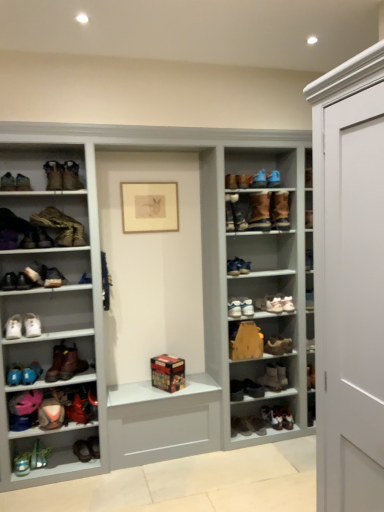
What is the approximate width of brown leather boot at lower left, acting as the ninth footwear starting from the bottom?

brown leather boot at lower left, acting as the ninth footwear starting from the bottom, is 25.95 centimeters in width.

What is the approximate width of shiny black sneakers at lower center, which ranks as the 4th footwear in bottom-to-top order?

shiny black sneakers at lower center, which ranks as the 4th footwear in bottom-to-top order, is 9.45 inches wide.

The image size is (384, 512). I want to click on leather boot at lower center, the ninth shoe viewed from the top, so click(239, 426).

Find the location of a particular element. This screenshot has height=512, width=384. wooden box at center is located at coordinates tap(168, 373).

Identify the location of matte brown boot at upper left, positioned as the 3th shoe in top-to-bottom order. Image resolution: width=384 pixels, height=512 pixels. (71, 176).

What is the approximate width of matte brown boot at upper left, which ranks as the seventh shoe in bottom-to-top order?

matte brown boot at upper left, which ranks as the seventh shoe in bottom-to-top order, is 10.83 inches in width.

The width and height of the screenshot is (384, 512). What are the coordinates of `brown leather boot at lower left, acting as the ninth footwear starting from the bottom` in the screenshot? It's located at (56, 362).

Which object is further away from the camera taking this photo, shiny black sneakers at lower center, which ranks as the 4th footwear in bottom-to-top order, or pink fabric shoe at lower left, the 14th footwear when ordered from top to bottom?

Positioned behind is shiny black sneakers at lower center, which ranks as the 4th footwear in bottom-to-top order.

Between point (272, 426) and point (29, 398), which one is positioned in front?

Positioned in front is point (29, 398).

Which object is positioned more to the left, shiny black sneakers at lower center, which ranks as the 4th footwear in bottom-to-top order, or pink fabric shoe at lower left, marked as the seventh footwear in a bottom-to-top arrangement?

pink fabric shoe at lower left, marked as the seventh footwear in a bottom-to-top arrangement.

Is shiny black sneakers at lower center, which ranks as the 4th footwear in bottom-to-top order, located outside pink fabric shoe at lower left, the 14th footwear when ordered from top to bottom?

That's correct, shiny black sneakers at lower center, which ranks as the 4th footwear in bottom-to-top order, is outside of pink fabric shoe at lower left, the 14th footwear when ordered from top to bottom.

Is matte black shoe at left, which ranks as the first shoe in left-to-right order, oriented towards matte blue sneaker at upper center, the 6th shoe positioned from the bottom?

No, matte black shoe at left, which ranks as the first shoe in left-to-right order, is not facing towards matte blue sneaker at upper center, the 6th shoe positioned from the bottom.

Is matte black shoe at left, the ninth shoe when ordered from right to left, further to camera compared to matte blue sneaker at upper center, which is counted as the fourth shoe, starting from the top?

No, matte black shoe at left, the ninth shoe when ordered from right to left, is closer to the camera.

From a real-world perspective, who is located lower, matte black shoe at left, the 6th shoe positioned from the top, or matte blue sneaker at upper center, the 6th shoe positioned from the bottom?

matte black shoe at left, the 6th shoe positioned from the top.

Does matte black shoe at left, which ranks as the first shoe in left-to-right order, have a lesser height compared to matte blue sneaker at upper center, which is counted as the fourth shoe, starting from the top?

Yes.

How different are the orientations of leather boot at lower left, the sixth footwear ordered from the bottom, and leather boot at left, which is the seventeenth footwear from bottom to top, in degrees?

The angular difference between leather boot at lower left, the sixth footwear ordered from the bottom, and leather boot at left, which is the seventeenth footwear from bottom to top, is 1.46 degrees.

Is leather boot at lower left, the sixth footwear ordered from the bottom, turned away from leather boot at left, which is the seventeenth footwear from bottom to top?

No, leather boot at lower left, the sixth footwear ordered from the bottom,'s orientation is not away from leather boot at left, which is the seventeenth footwear from bottom to top.

Based on the photo, from the image's perspective, is leather boot at lower left, the sixth footwear ordered from the bottom, on leather boot at left, which is the seventeenth footwear from bottom to top?

No, from the image's perspective, leather boot at lower left, the sixth footwear ordered from the bottom, is not above leather boot at left, which is the seventeenth footwear from bottom to top.

Which object is positioned more to the left, leather boot at lower left, the sixth footwear ordered from the bottom, or leather boot at left, which is the seventeenth footwear from bottom to top?

leather boot at lower left, the sixth footwear ordered from the bottom, is more to the left.

From the image's perspective, between white leather sneakers at center, arranged as the 1th shoe when viewed from the right, and leather boot at lower left, the 2th footwear from the bottom, which one is located above?

white leather sneakers at center, arranged as the 1th shoe when viewed from the right.

Is white leather sneakers at center, arranged as the ninth shoe when viewed from the left, not within leather boot at lower left, placed as the nineteenth footwear when sorted from top to bottom?

That's correct, white leather sneakers at center, arranged as the ninth shoe when viewed from the left, is outside of leather boot at lower left, placed as the nineteenth footwear when sorted from top to bottom.

Is white leather sneakers at center, which is counted as the 7th shoe, starting from the top, with leather boot at lower left, the 2th footwear from the bottom?

There is a gap between white leather sneakers at center, which is counted as the 7th shoe, starting from the top, and leather boot at lower left, the 2th footwear from the bottom.

Is white leather sneakers at center, arranged as the 1th shoe when viewed from the right, smaller than matte brown boot at center, the 3th shoe from the left?

No, white leather sneakers at center, arranged as the 1th shoe when viewed from the right, is not smaller than matte brown boot at center, the 3th shoe from the left.

From the image's perspective, is white leather sneakers at center, arranged as the 1th shoe when viewed from the right, on top of matte brown boot at center, the 3th shoe from the left?

Incorrect, from the image's perspective, white leather sneakers at center, arranged as the 1th shoe when viewed from the right, is lower than matte brown boot at center, the 3th shoe from the left.

From the image's perspective, starting from the matte brown boot at center, the 3th shoe from the left, which shoe is the 2nd one below? Please provide its 2D coordinates.

[(269, 304)]

How different are the orientations of white leather sneakers at center, arranged as the 1th shoe when viewed from the right, and matte brown boot at center, which ranks as the 5th shoe in bottom-to-top order, in degrees?

4.98 degrees.

From the image's perspective, which object appears higher, leather boot at lower center, which ranks as the 1th shoe in bottom-to-top order, or wooden box at center?

wooden box at center appears higher in the image.

Is leather boot at lower center, which is counted as the fifth shoe, starting from the left, facing away from wooden box at center?

No, leather boot at lower center, which is counted as the fifth shoe, starting from the left, is not facing away from wooden box at center.

Measure the distance between leather boot at lower center, the ninth shoe viewed from the top, and wooden box at center.

They are 24.64 inches apart.

Between white leather sneakers at center, which is the eighth shoe in top-to-bottom order, and white leather shoe at lower left, placed as the eighth footwear when sorted from top to bottom, which one has larger size?

white leather sneakers at center, which is the eighth shoe in top-to-bottom order, is bigger.

Is there a large distance between white leather sneakers at center, the sixth shoe in the left-to-right sequence, and white leather shoe at lower left, placed as the eighth footwear when sorted from top to bottom?

Indeed, white leather sneakers at center, the sixth shoe in the left-to-right sequence, is not near white leather shoe at lower left, placed as the eighth footwear when sorted from top to bottom.

Who is taller, white leather sneakers at center, the sixth shoe in the left-to-right sequence, or white leather shoe at lower left, placed as the eighth footwear when sorted from top to bottom?

white leather sneakers at center, the sixth shoe in the left-to-right sequence, is taller.

Which is less distant, (x=244, y=298) or (x=27, y=326)?

Positioned in front is point (x=27, y=326).

At what (x,y) coordinates should I click in order to perform the action: click on the 3rd footwear located beneath the pink fabric shoe at lower left, the 14th footwear when ordered from top to bottom (from a real-world perspective). Please return your answer as a coordinate pair (x, y). This screenshot has width=384, height=512. Looking at the image, I should click on (272, 417).

Starting from the matte black shoe at left, acting as the 4th shoe starting from the bottom, which shoe is the 6th one to the right? Please provide its 2D coordinates.

[(244, 266)]

Which object lies further to the anchor point leather boot at lower left, the 2th footwear from the bottom, brown suede boot at center-right, the eleventh footwear positioned from the bottom, or shiny black sneakers at lower center, which ranks as the 4th footwear in bottom-to-top order?

Among the two, brown suede boot at center-right, the eleventh footwear positioned from the bottom, is located further to leather boot at lower left, the 2th footwear from the bottom.

Looking at the image, which one is located closer to brown suede boot at upper center, positioned as the 4th shoe in left-to-right order, brown suede boots at upper center, marked as the third footwear in a top-to-bottom arrangement, or white leather sneakers at center, the sixth shoe in the left-to-right sequence?

brown suede boots at upper center, marked as the third footwear in a top-to-bottom arrangement, lies closer to brown suede boot at upper center, positioned as the 4th shoe in left-to-right order, than the other object.

From the image, which object appears to be farther from brown suede boot at center-right, the eleventh footwear positioned from the bottom, white leather shoe at lower left, the 13th footwear from the bottom, or brown suede boots at upper right, positioned as the 19th footwear in bottom-to-top order?

white leather shoe at lower left, the 13th footwear from the bottom, is positioned further to the anchor brown suede boot at center-right, the eleventh footwear positioned from the bottom.

Considering their positions, is matte brown boot at center, which ranks as the 5th shoe in bottom-to-top order, positioned closer to leather boot at lower left, the 2th footwear from the bottom, than brown leather boot at lower left, acting as the ninth footwear starting from the bottom?

brown leather boot at lower left, acting as the ninth footwear starting from the bottom.

Looking at the image, which one is located closer to leather boot at center, acting as the 18th footwear starting from the top, matte black shoe at left, positioned as the 7th footwear in top-to-bottom order, or brown suede boot at upper center, which is counted as the 2th shoe, starting from the top?

Based on the image, brown suede boot at upper center, which is counted as the 2th shoe, starting from the top, appears to be nearer to leather boot at center, acting as the 18th footwear starting from the top.

When comparing their distances from shiny brown boot at lower left, acting as the first footwear starting from the bottom, does matte brown boot at center, the 7th shoe from the right, or white suede boot at lower center, which appears as the 8th footwear when ordered from the bottom, seem further?

white suede boot at lower center, which appears as the 8th footwear when ordered from the bottom, is positioned further to the anchor shiny brown boot at lower left, acting as the first footwear starting from the bottom.

Which object lies further to the anchor point leather boot at lower center, which ranks as the 1th shoe in bottom-to-top order, white leather sneakers at center, the 4th shoe positioned from the right, or brown suede boot at upper left, which is counted as the 1th footwear, starting from the top?

brown suede boot at upper left, which is counted as the 1th footwear, starting from the top, is positioned further to the anchor leather boot at lower center, which ranks as the 1th shoe in bottom-to-top order.

From the image, which object appears to be nearer to pink fabric shoe at lower left, the 14th footwear when ordered from top to bottom, brown leather boot at lower left, the twelfth footwear when ordered from top to bottom, or matte brown boot at center, the 3th shoe from the left?

brown leather boot at lower left, the twelfth footwear when ordered from top to bottom.

Find the location of a particular element. shelf between matte black shoe at left, the ninth shoe when ordered from right to left, and leather boot at lower left, placed as the nineteenth footwear when sorted from top to bottom, in the up-down direction is located at coordinates (119, 285).

The height and width of the screenshot is (512, 384). Find the location of `box between brown suede boot at upper center, acting as the ninth shoe starting from the bottom, and leather boot at lower left, placed as the nineteenth footwear when sorted from top to bottom, from top to bottom`. box between brown suede boot at upper center, acting as the ninth shoe starting from the bottom, and leather boot at lower left, placed as the nineteenth footwear when sorted from top to bottom, from top to bottom is located at coordinates (168, 373).

In order to click on shelf between brown suede boots at upper center, marked as the third footwear in a top-to-bottom arrangement, and brown suede boot at center-right, the eleventh footwear positioned from the bottom, in the up-down direction in this screenshot , I will do `click(119, 285)`.

Image resolution: width=384 pixels, height=512 pixels. Find the location of `shelf located between shiny brown boot at lower left, positioned as the twentieth footwear in top-to-bottom order, and white leather sneakers at center, arranged as the 1th shoe when viewed from the right, in the left-right direction`. shelf located between shiny brown boot at lower left, positioned as the twentieth footwear in top-to-bottom order, and white leather sneakers at center, arranged as the 1th shoe when viewed from the right, in the left-right direction is located at coordinates (119, 285).